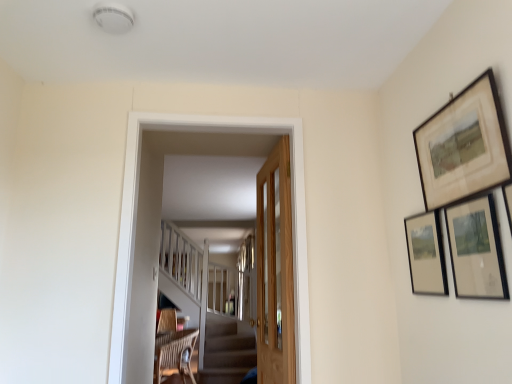
Question: Is wooden door at center oriented towards wooden door at center?

Choices:
 (A) yes
 (B) no

Answer: (A)

Question: Is wooden door at center not close to wooden door at center?

Choices:
 (A) yes
 (B) no

Answer: (B)

Question: From a real-world perspective, is wooden door at center under wooden door at center?

Choices:
 (A) yes
 (B) no

Answer: (A)

Question: Does wooden door at center have a greater width compared to wooden door at center?

Choices:
 (A) no
 (B) yes

Answer: (A)

Question: Is wooden door at center to the right of wooden door at center from the viewer's perspective?

Choices:
 (A) no
 (B) yes

Answer: (B)

Question: Is wooden door at center with wooden door at center?

Choices:
 (A) no
 (B) yes

Answer: (A)

Question: From a real-world perspective, is wooden-framed artwork at upper right, the first picture frame when ordered from top to bottom, beneath wooden door at center?

Choices:
 (A) yes
 (B) no

Answer: (B)

Question: Can you confirm if wooden-framed artwork at upper right, the first picture frame when ordered from top to bottom, is taller than wooden door at center?

Choices:
 (A) no
 (B) yes

Answer: (A)

Question: Is wooden-framed artwork at upper right, the first picture frame when ordered from top to bottom, directly adjacent to wooden door at center?

Choices:
 (A) yes
 (B) no

Answer: (B)

Question: Does wooden-framed artwork at upper right, the first picture frame when ordered from top to bottom, have a greater width compared to wooden door at center?

Choices:
 (A) no
 (B) yes

Answer: (A)

Question: Is wooden-framed artwork at upper right, which is counted as the third picture frame, starting from the bottom, at the right side of wooden door at center?

Choices:
 (A) yes
 (B) no

Answer: (A)

Question: Can you confirm if wooden-framed artwork at upper right, which is counted as the third picture frame, starting from the bottom, is thinner than wooden door at center?

Choices:
 (A) no
 (B) yes

Answer: (B)

Question: From a real-world perspective, is wooden-framed picture at upper right, arranged as the 3th picture frame when viewed from the top, on top of wooden door at center?

Choices:
 (A) no
 (B) yes

Answer: (B)